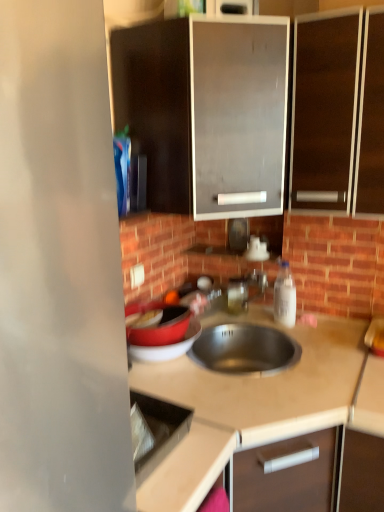
Question: From a real-world perspective, relative to matte black cabinet at upper center, which is the 1th cabinetry in left-to-right order, is white plastic electric outlet at upper center vertically above or below?

Choices:
 (A) above
 (B) below

Answer: (B)

Question: Considering the positions of white plastic electric outlet at upper center and matte black cabinet at upper center, the second cabinetry from the right, in the image, is white plastic electric outlet at upper center wider or thinner than matte black cabinet at upper center, the second cabinetry from the right,?

Choices:
 (A) thin
 (B) wide

Answer: (A)

Question: Estimate the real-world distances between objects in this image. Which object is farther from the matte black cabinet at upper center, which is the 1th cabinetry in left-to-right order?

Choices:
 (A) white plastic electric outlet at upper center
 (B) beige laminate countertop at center
 (C) dark wood cabinet at upper right, the second cabinetry viewed from the left
 (D) white plastic bottle at right

Answer: (B)

Question: Which object is the farthest from the dark wood cabinet at upper right, the first cabinetry from the right?

Choices:
 (A) beige laminate countertop at center
 (B) white plastic electric outlet at upper center
 (C) white plastic bottle at right
 (D) matte black cabinet at upper center, which is the 1th cabinetry in left-to-right order

Answer: (B)